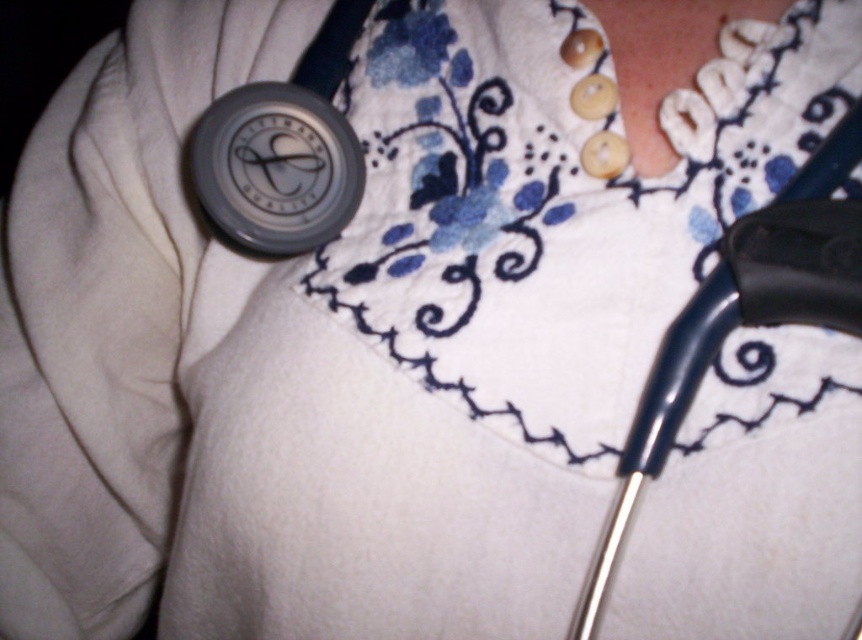
Question: Does metallic blue stethoscope at right have a lesser width compared to pearl-like buttons at upper right?

Choices:
 (A) yes
 (B) no

Answer: (B)

Question: Which of the following is the farthest from the observer?

Choices:
 (A) metallic blue stethoscope at right
 (B) pearl-like buttons at upper right
 (C) matte gray stethoscope at center

Answer: (B)

Question: Which point is closer to the camera?

Choices:
 (A) (659, 452)
 (B) (711, 17)
 (C) (291, 97)

Answer: (A)

Question: Which point is farther from the camera taking this photo?

Choices:
 (A) (745, 308)
 (B) (270, 148)

Answer: (B)

Question: Is metallic blue stethoscope at right positioned at the back of matte gray stethoscope at center?

Choices:
 (A) yes
 (B) no

Answer: (B)

Question: Does matte gray stethoscope at center have a greater width compared to pearl-like buttons at upper right?

Choices:
 (A) no
 (B) yes

Answer: (A)